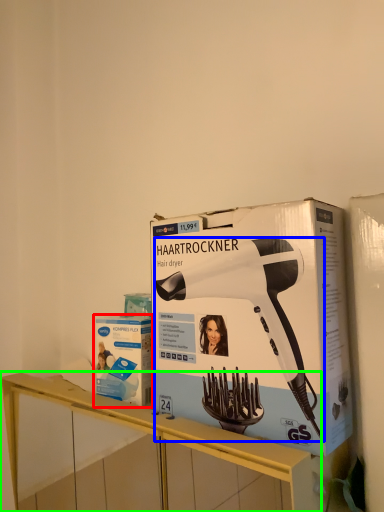
Question: Estimate the real-world distances between objects in this image. Which object is closer to box (highlighted by a red box), hair drier (highlighted by a blue box) or furniture (highlighted by a green box)?

Choices:
 (A) hair drier
 (B) furniture

Answer: (B)